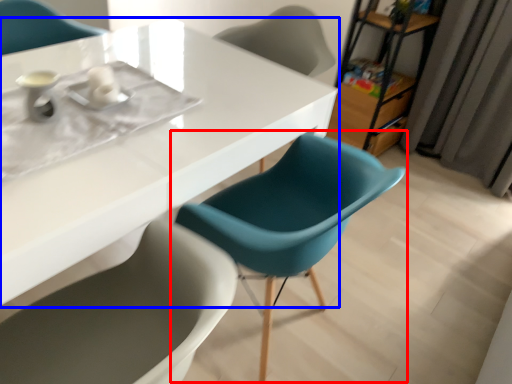
Question: Among these objects, which one is nearest to the camera, chair (highlighted by a red box) or table (highlighted by a blue box)?

Choices:
 (A) chair
 (B) table

Answer: (B)